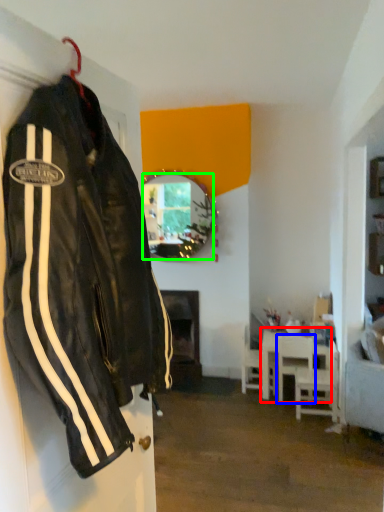
Question: Considering the real-world distances, which object is closest to table (highlighted by a red box)? chair (highlighted by a blue box) or mirror (highlighted by a green box).

Choices:
 (A) chair
 (B) mirror

Answer: (A)